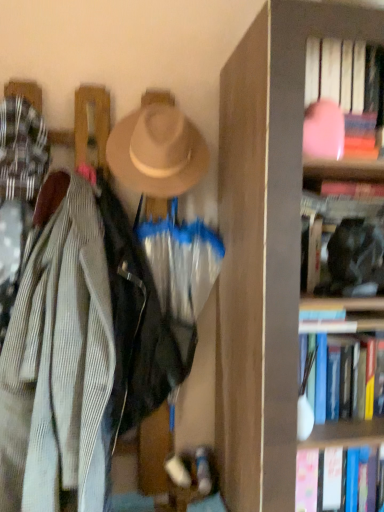
Question: Considering the relative positions of pink matte book at upper right, the first book in the top-to-bottom sequence, and black matte bookshelf at upper right, the second book when ordered from bottom to top, in the image provided, is pink matte book at upper right, the first book in the top-to-bottom sequence, to the left or to the right of black matte bookshelf at upper right, the second book when ordered from bottom to top,?

Choices:
 (A) right
 (B) left

Answer: (B)

Question: Is pink matte book at upper right, the first book in the top-to-bottom sequence, bigger or smaller than black matte bookshelf at upper right, the 2th book from the top?

Choices:
 (A) small
 (B) big

Answer: (B)

Question: Considering the real-world distances, which object is farthest from the pink matte book at upper right, which ranks as the third book in bottom-to-top order?

Choices:
 (A) beige felt hat at upper center
 (B) black matte bookshelf at upper right, the 2th book from the top
 (C) wooden bookcase at right
 (D) hardcover book at right, which is the 1th book in bottom-to-top order

Answer: (D)

Question: Estimate the real-world distances between objects in this image. Which object is farther from the black matte bookshelf at upper right, the second book when ordered from bottom to top?

Choices:
 (A) beige felt hat at upper center
 (B) hardcover book at right, positioned as the third book in top-to-bottom order
 (C) wooden bookcase at right
 (D) pink matte book at upper right, the first book in the top-to-bottom sequence

Answer: (A)